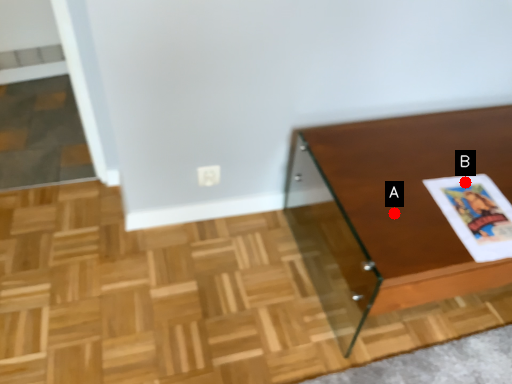
Question: Two points are circled on the image, labeled by A and B beside each circle. Which point appears closest to the camera in this image?

Choices:
 (A) A is closer
 (B) B is closer

Answer: (A)